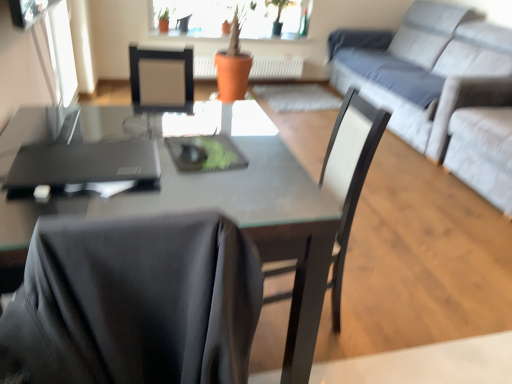
Where is `free space behind black matte laptop at left`? The width and height of the screenshot is (512, 384). free space behind black matte laptop at left is located at coordinates (117, 125).